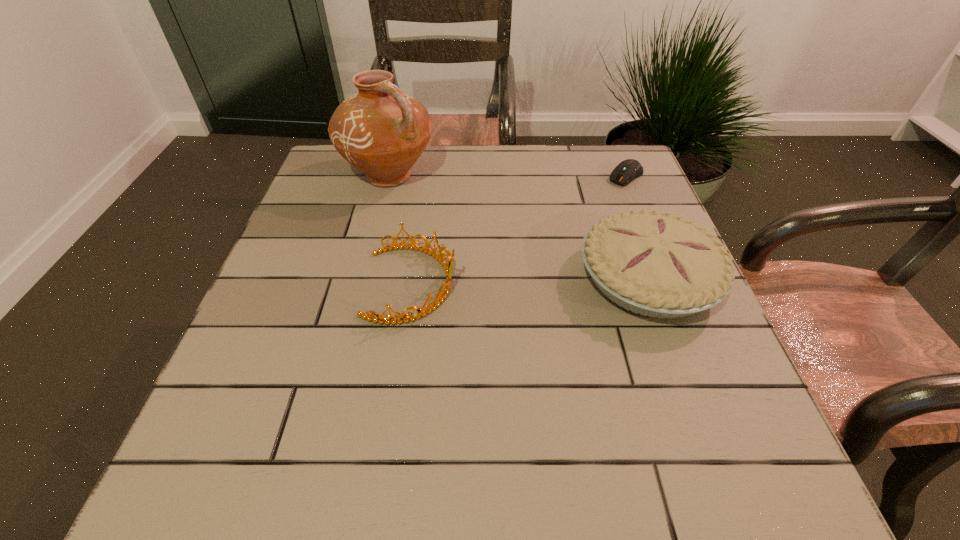
Identify the location of free point between the pottery and the pie. The width and height of the screenshot is (960, 540). (518, 227).

Image resolution: width=960 pixels, height=540 pixels. I want to click on vacant region between the tiara and the tallest object, so click(400, 230).

At what (x,y) coordinates should I click in order to perform the action: click on vacant area that lies between the pie and the tiara. Please return your answer as a coordinate pair (x, y). The height and width of the screenshot is (540, 960). Looking at the image, I should click on (529, 281).

Choose which object is the third nearest neighbor to the pie. Please provide its 2D coordinates. Your answer should be formatted as a tuple, i.e. [(x, y)], where the tuple contains the x and y coordinates of a point satisfying the conditions above.

[(382, 131)]

Select which object appears as the second closest to the tiara. Please provide its 2D coordinates. Your answer should be formatted as a tuple, i.e. [(x, y)], where the tuple contains the x and y coordinates of a point satisfying the conditions above.

[(654, 264)]

Locate an element on the screen. free space that satisfies the following two spatial constraints: 1. on the back side of the shortest object; 2. on the left side of the pie is located at coordinates click(x=610, y=176).

In order to click on vacant space that satisfies the following two spatial constraints: 1. on the front side of the pottery; 2. on the left side of the pie in this screenshot , I will do `click(363, 279)`.

Find the location of a particular element. The image size is (960, 540). vacant space that satisfies the following two spatial constraints: 1. on the front side of the pottery; 2. on the front-facing side of the tiara is located at coordinates [362, 284].

I want to click on free spot that satisfies the following two spatial constraints: 1. on the front side of the tallest object; 2. on the front-facing side of the tiara, so click(x=362, y=284).